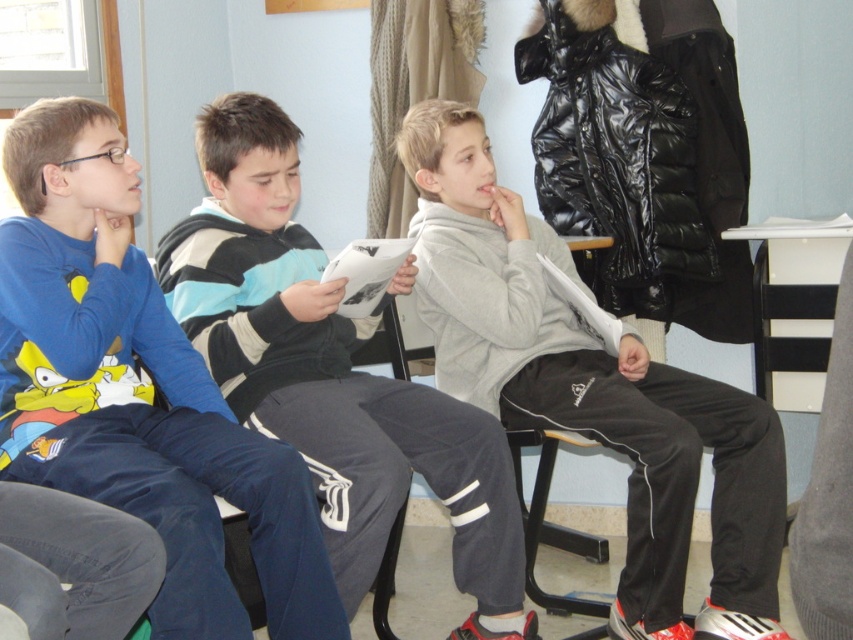
Is point (64, 134) positioned behind point (347, 579)?

No, it is in front of (347, 579).

Is point (123, 353) positioned before point (515, 552)?

Yes, it is.

Is point (62, 227) in front of point (397, 284)?

Yes, point (62, 227) is in front of point (397, 284).

Identify the location of blue cotton shirt at left. (137, 390).

Which of these two, blue cotton shirt at left or gray matte sweatshirt at center, stands taller?

gray matte sweatshirt at center is taller.

Does point (146, 314) come closer to viewer compared to point (749, 536)?

Yes, it is.

Is point (212, 529) positioned behind point (747, 477)?

That is False.

The height and width of the screenshot is (640, 853). I want to click on blue cotton shirt at left, so click(x=137, y=390).

Is point (627, 332) more distant than point (361, 417)?

Yes, it is behind point (361, 417).

Who is shorter, gray matte sweatshirt at center or striped sweater at center?

Standing shorter between the two is striped sweater at center.

At what (x,y) coordinates should I click in order to perform the action: click on gray matte sweatshirt at center. Please return your answer as a coordinate pair (x, y). Looking at the image, I should click on (592, 390).